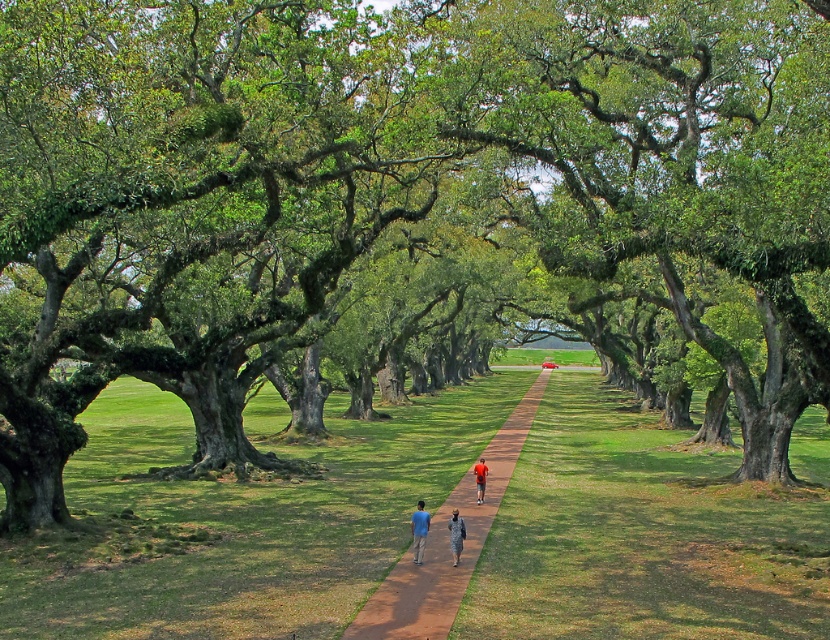
Question: Can you confirm if brown dirt path at center is positioned to the right of orange fabric person at center?

Choices:
 (A) no
 (B) yes

Answer: (B)

Question: Can you confirm if brown dirt path at center is positioned below blue cotton shirt at center?

Choices:
 (A) no
 (B) yes

Answer: (B)

Question: Which object appears closest to the camera in this image?

Choices:
 (A) blue cotton shirt at center
 (B) brown dirt path at center
 (C) camouflage fabric person at center
 (D) green mossy tree at center

Answer: (B)

Question: Among these points, which one is farthest from the camera?

Choices:
 (A) (354, 621)
 (B) (484, 467)
 (C) (457, 547)

Answer: (B)

Question: Which point is closer to the camera?

Choices:
 (A) camouflage fabric person at center
 (B) brown dirt path at center
 (C) blue cotton shirt at center
 (D) green mossy tree at center

Answer: (B)

Question: Considering the relative positions of green mossy tree at center and orange fabric person at center in the image provided, where is green mossy tree at center located with respect to orange fabric person at center?

Choices:
 (A) right
 (B) left

Answer: (A)